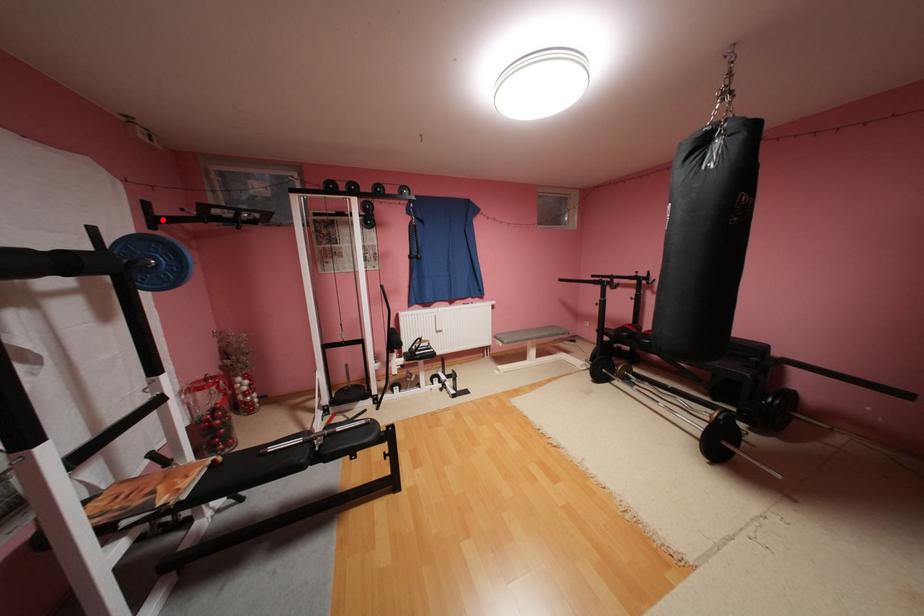
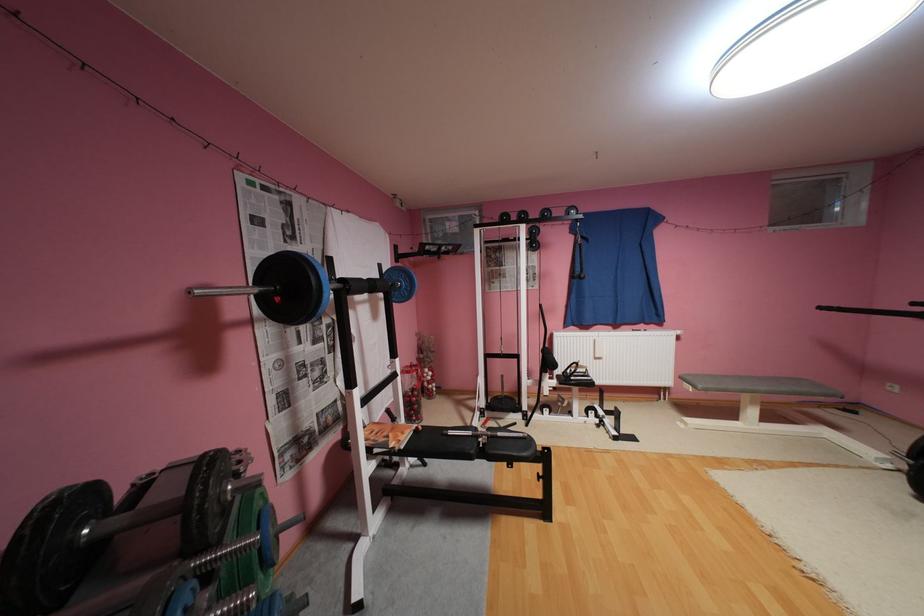
The point at the highlighted location is marked in the first image. Where is the corresponding point in the second image?

(407, 256)